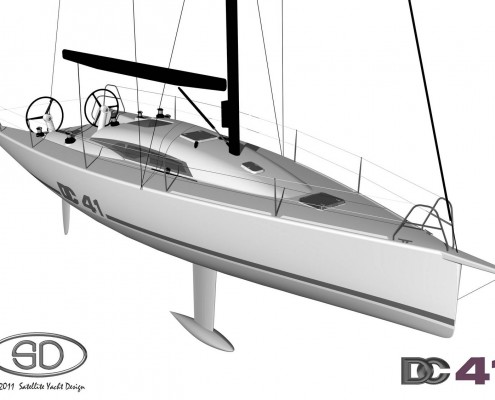
This screenshot has height=400, width=495. What are the coordinates of `side rails` in the screenshot? It's located at (292, 184), (324, 209), (386, 168), (381, 189).